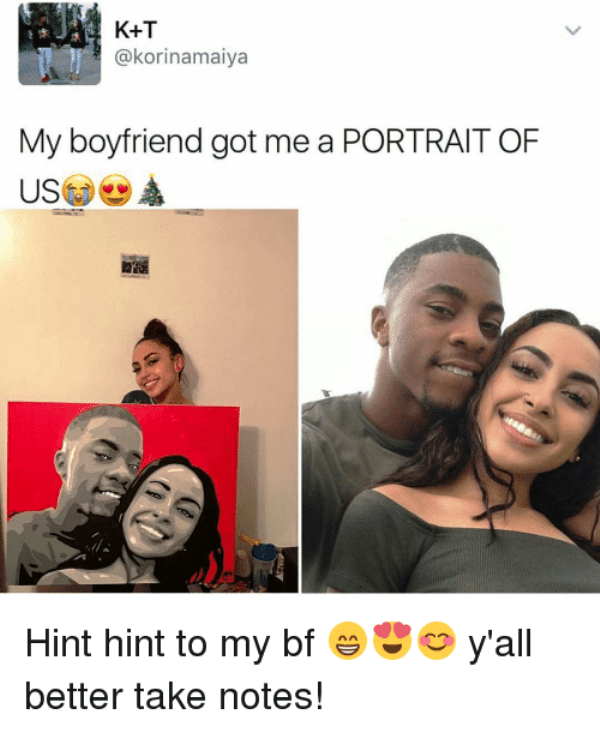
Identify the location of christmas tree emoji. This screenshot has width=600, height=732. (154, 198).